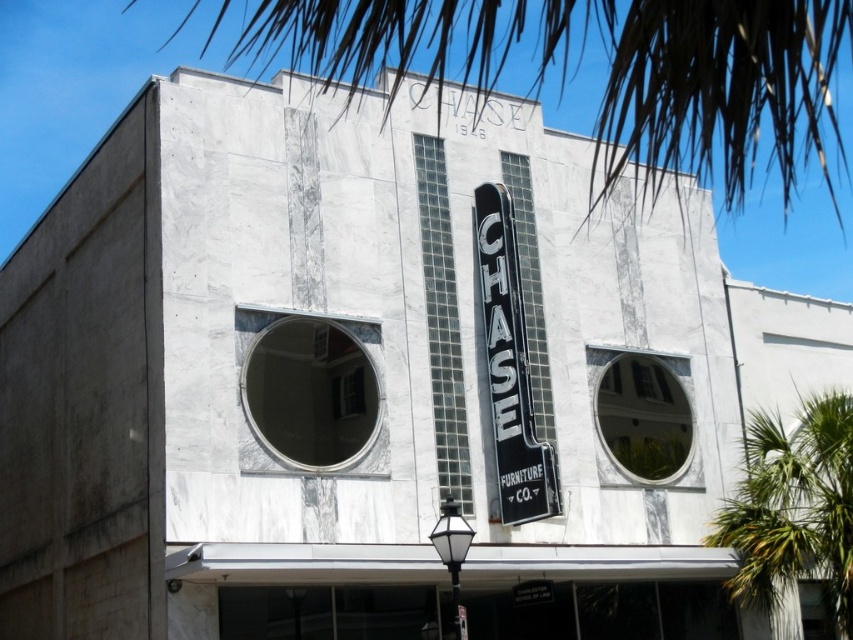
Between point (819, 412) and point (505, 324), which one is positioned behind?

The point (819, 412) is behind.

Is green leafy palm tree at right closer to camera compared to black metal sign at center?

That is False.

The height and width of the screenshot is (640, 853). Describe the element at coordinates (793, 509) in the screenshot. I see `green leafy palm tree at right` at that location.

Locate an element on the screen. green leafy palm tree at right is located at coordinates (793, 509).

Which is more to the left, brown leafy palm tree at upper center or black metal sign at center?

brown leafy palm tree at upper center

Locate an element on the screen. brown leafy palm tree at upper center is located at coordinates (607, 74).

Does brown leafy palm tree at upper center appear over green leafy palm tree at right?

Indeed, brown leafy palm tree at upper center is positioned over green leafy palm tree at right.

Is brown leafy palm tree at upper center below green leafy palm tree at right?

Incorrect, brown leafy palm tree at upper center is not positioned below green leafy palm tree at right.

Which is in front, point (693, 125) or point (779, 472)?

Positioned in front is point (693, 125).

Where is `brown leafy palm tree at upper center`? This screenshot has width=853, height=640. brown leafy palm tree at upper center is located at coordinates (607, 74).